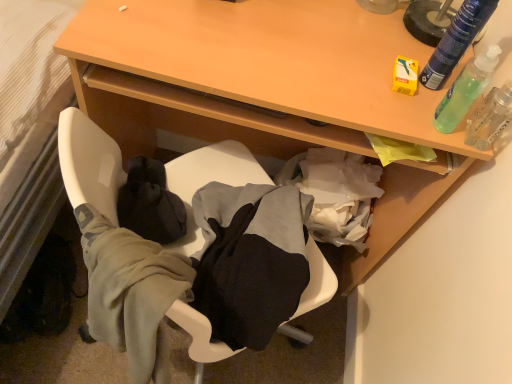
Question: Is green translucent bottle at upper right, the 2th bottle in the top-to-bottom sequence, to the right of clear plastic spray bottle at upper right from the viewer's perspective?

Choices:
 (A) yes
 (B) no

Answer: (B)

Question: Is green translucent bottle at upper right, the 2th bottle in the top-to-bottom sequence, behind clear plastic spray bottle at upper right?

Choices:
 (A) yes
 (B) no

Answer: (B)

Question: Is green translucent bottle at upper right, the 2th bottle in the top-to-bottom sequence, to the left of clear plastic spray bottle at upper right from the viewer's perspective?

Choices:
 (A) yes
 (B) no

Answer: (A)

Question: Is green translucent bottle at upper right, the 2th bottle in the top-to-bottom sequence, turned away from clear plastic spray bottle at upper right?

Choices:
 (A) yes
 (B) no

Answer: (B)

Question: From a real-world perspective, is green translucent bottle at upper right, positioned as the 1th bottle in bottom-to-top order, positioned under clear plastic spray bottle at upper right based on gravity?

Choices:
 (A) yes
 (B) no

Answer: (B)

Question: From a real-world perspective, relative to wooden table at upper center, is soft fabric chair at lower center vertically above or below?

Choices:
 (A) above
 (B) below

Answer: (A)

Question: Considering the positions of soft fabric chair at lower center and wooden table at upper center in the image, is soft fabric chair at lower center wider or thinner than wooden table at upper center?

Choices:
 (A) thin
 (B) wide

Answer: (A)

Question: Considering the positions of soft fabric chair at lower center and wooden table at upper center in the image, is soft fabric chair at lower center bigger or smaller than wooden table at upper center?

Choices:
 (A) small
 (B) big

Answer: (A)

Question: Is soft fabric chair at lower center inside the boundaries of wooden table at upper center, or outside?

Choices:
 (A) inside
 (B) outside

Answer: (B)

Question: Considering the positions of green translucent bottle at upper right, the 2th bottle in the top-to-bottom sequence, and wooden table at upper center in the image, is green translucent bottle at upper right, the 2th bottle in the top-to-bottom sequence, wider or thinner than wooden table at upper center?

Choices:
 (A) thin
 (B) wide

Answer: (A)

Question: Looking at the image, does green translucent bottle at upper right, positioned as the 1th bottle in bottom-to-top order, seem bigger or smaller compared to wooden table at upper center?

Choices:
 (A) small
 (B) big

Answer: (A)

Question: Considering the positions of green translucent bottle at upper right, the 2th bottle in the top-to-bottom sequence, and wooden table at upper center in the image, is green translucent bottle at upper right, the 2th bottle in the top-to-bottom sequence, taller or shorter than wooden table at upper center?

Choices:
 (A) tall
 (B) short

Answer: (B)

Question: Is green translucent bottle at upper right, positioned as the 1th bottle in bottom-to-top order, to the left or to the right of wooden table at upper center in the image?

Choices:
 (A) left
 (B) right

Answer: (B)

Question: Is point (493, 105) closer or farther from the camera than point (472, 4)?

Choices:
 (A) closer
 (B) farther

Answer: (B)

Question: In terms of width, does clear plastic spray bottle at upper right look wider or thinner when compared to green translucent bottle at upper right, which appears as the 2th bottle when ordered from the bottom?

Choices:
 (A) wide
 (B) thin

Answer: (A)